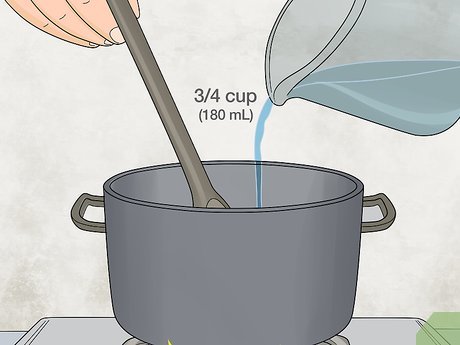
This screenshot has height=345, width=460. What are the coordinates of `measuring cup` in the screenshot? It's located at (355, 47).